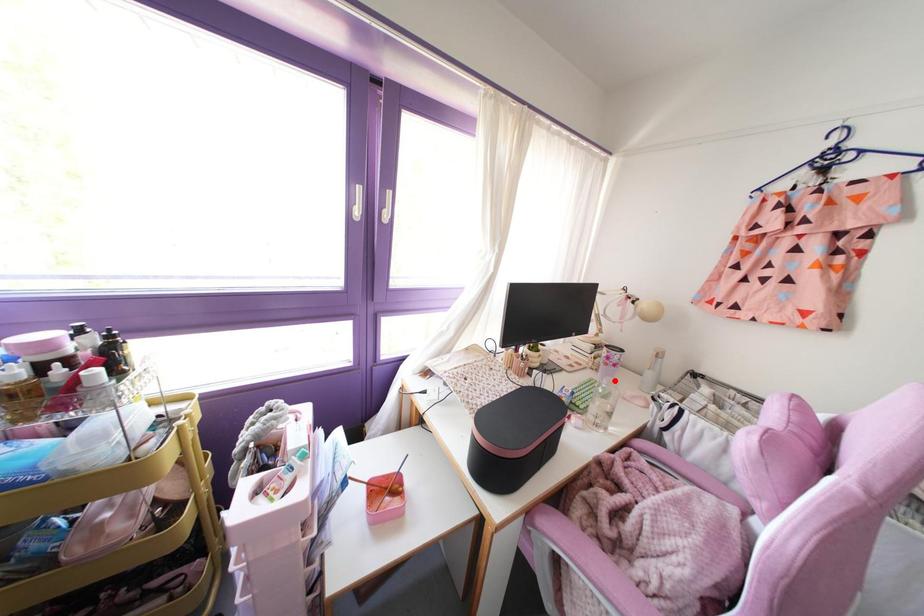
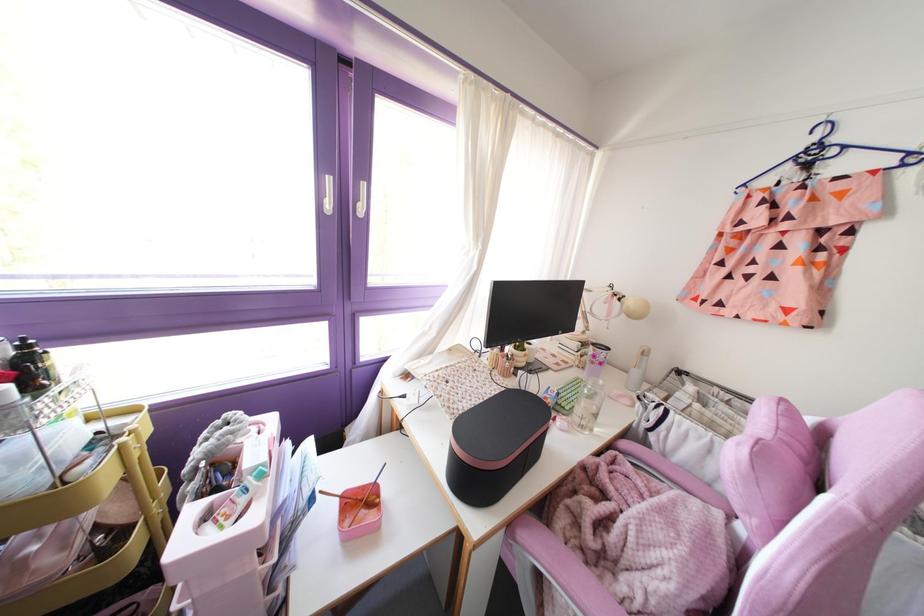
Find the pixel in the second image that matches the highlighted location in the first image.

(601, 382)